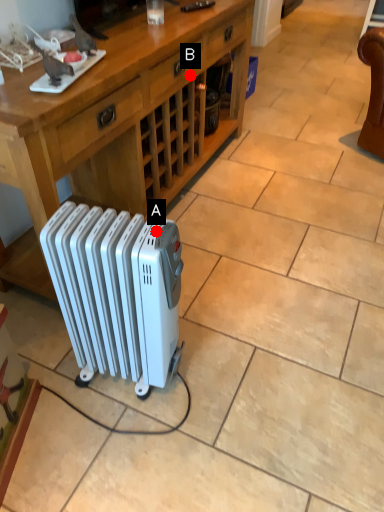
Question: Two points are circled on the image, labeled by A and B beside each circle. Which point appears farthest from the camera in this image?

Choices:
 (A) A is further
 (B) B is further

Answer: (B)